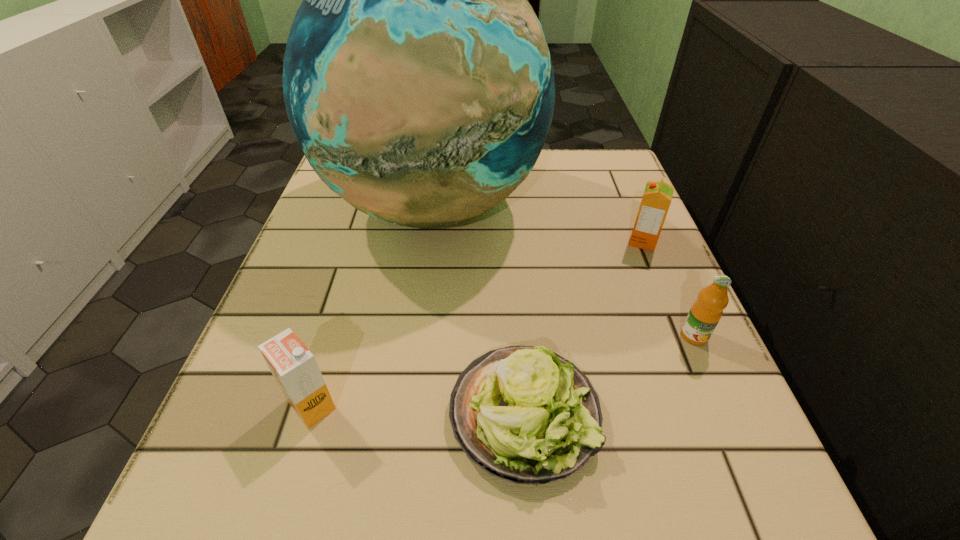
You are a GUI agent. You are given a task and a screenshot of the screen. Output one action in this format:
    pyautogui.click(x=<x>, y=<y>)
    Task: Click on the globe
    
    Given the screenshot: What is the action you would take?
    pyautogui.click(x=417, y=79)

Image resolution: width=960 pixels, height=540 pixels. I want to click on the farthest orange juice, so click(657, 197).

Image resolution: width=960 pixels, height=540 pixels. I want to click on the nearest orange juice, so click(294, 367).

Locate an element on the screen. The image size is (960, 540). the second farthest orange juice is located at coordinates (705, 313).

The width and height of the screenshot is (960, 540). In order to click on the shortest object in this screenshot , I will do pos(525,414).

This screenshot has height=540, width=960. What are the coordinates of `vacant position located on the front of the globe` in the screenshot? It's located at (400, 457).

Locate an element on the screen. vacant area situated 0.200m on the left of the farthest orange juice is located at coordinates (522, 241).

At what (x,y) coordinates should I click in order to perform the action: click on vacant space located 0.240m on the back of the leftmost orange juice. Please return your answer as a coordinate pair (x, y). Looking at the image, I should click on (353, 267).

Locate an element on the screen. vacant area situated 0.210m on the label of the third farthest object is located at coordinates (762, 491).

You are a GUI agent. You are given a task and a screenshot of the screen. Output one action in this format:
    pyautogui.click(x=<x>, y=<y>)
    Task: Click on the vacant space located on the right of the shortest object
    This screenshot has height=540, width=960.
    Given the screenshot: What is the action you would take?
    pyautogui.click(x=696, y=414)